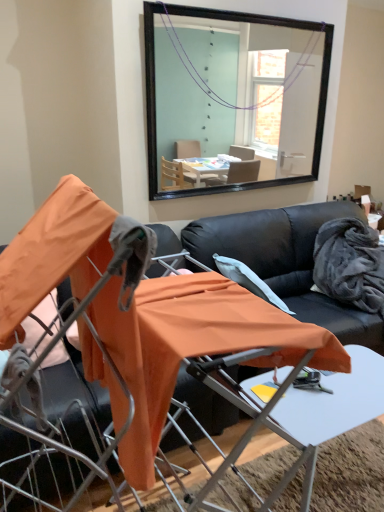
Question: Can you confirm if orange fabric chair at center, the 1th chair when ordered from left to right, is wider than black leather couch at center?

Choices:
 (A) no
 (B) yes

Answer: (A)

Question: Is orange fabric chair at center, marked as the second chair in a right-to-left arrangement, facing towards black leather couch at center?

Choices:
 (A) yes
 (B) no

Answer: (B)

Question: Considering the relative sizes of orange fabric chair at center, the 1th chair when ordered from left to right, and black leather couch at center in the image provided, is orange fabric chair at center, the 1th chair when ordered from left to right, shorter than black leather couch at center?

Choices:
 (A) no
 (B) yes

Answer: (B)

Question: Is the depth of orange fabric chair at center, marked as the second chair in a right-to-left arrangement, greater than that of black leather couch at center?

Choices:
 (A) yes
 (B) no

Answer: (B)

Question: From the image's perspective, is orange fabric chair at center, the 1th chair when ordered from left to right, on black leather couch at center?

Choices:
 (A) yes
 (B) no

Answer: (A)

Question: Is orange fabric chair at center, the first chair when ordered from right to left, taller or shorter than velvety gray blanket at right?

Choices:
 (A) short
 (B) tall

Answer: (B)

Question: Looking at their shapes, would you say orange fabric chair at center, positioned as the second chair in left-to-right order, is wider or thinner than velvety gray blanket at right?

Choices:
 (A) thin
 (B) wide

Answer: (B)

Question: Is point (105, 294) closer or farther from the camera than point (326, 246)?

Choices:
 (A) closer
 (B) farther

Answer: (A)

Question: Visually, is orange fabric chair at center, the first chair when ordered from right to left, positioned to the left or to the right of velvety gray blanket at right?

Choices:
 (A) left
 (B) right

Answer: (A)

Question: In terms of height, does orange fabric table at center look taller or shorter compared to orange fabric chair at center, marked as the second chair in a right-to-left arrangement?

Choices:
 (A) short
 (B) tall

Answer: (A)

Question: From the image's perspective, is orange fabric table at center located above or below orange fabric chair at center, the 1th chair when ordered from left to right?

Choices:
 (A) above
 (B) below

Answer: (B)

Question: Considering their positions, is orange fabric table at center located in front of or behind orange fabric chair at center, the 1th chair when ordered from left to right?

Choices:
 (A) behind
 (B) front

Answer: (A)

Question: Is point (286, 375) closer or farther from the camera than point (26, 481)?

Choices:
 (A) farther
 (B) closer

Answer: (B)

Question: From a real-world perspective, is black leather couch at center positioned above or below orange fabric chair at center, positioned as the second chair in left-to-right order?

Choices:
 (A) below
 (B) above

Answer: (A)

Question: Looking at their shapes, would you say black leather couch at center is wider or thinner than orange fabric chair at center, the first chair when ordered from right to left?

Choices:
 (A) wide
 (B) thin

Answer: (A)